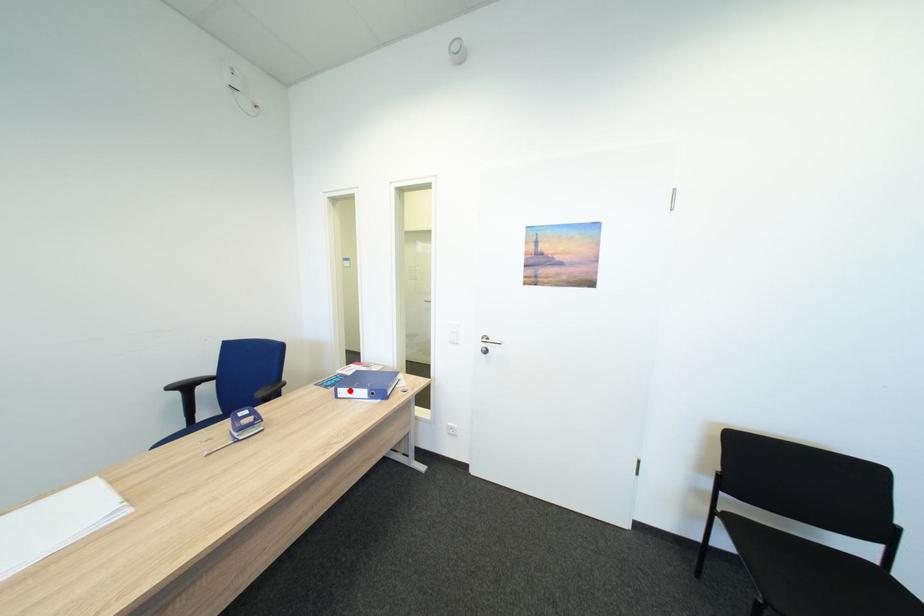
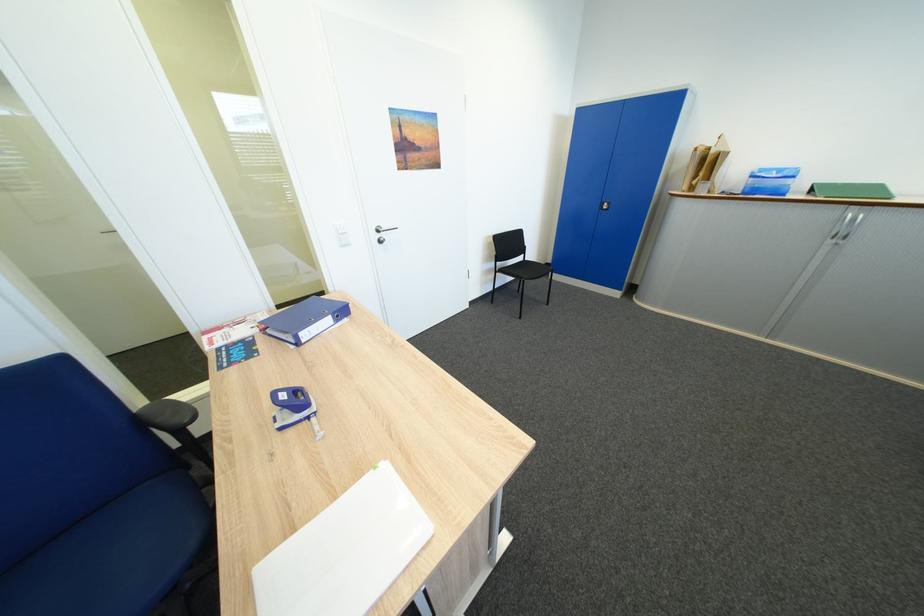
Where in the second image is the point corresponding to the highlighted location from the first image?

(310, 334)